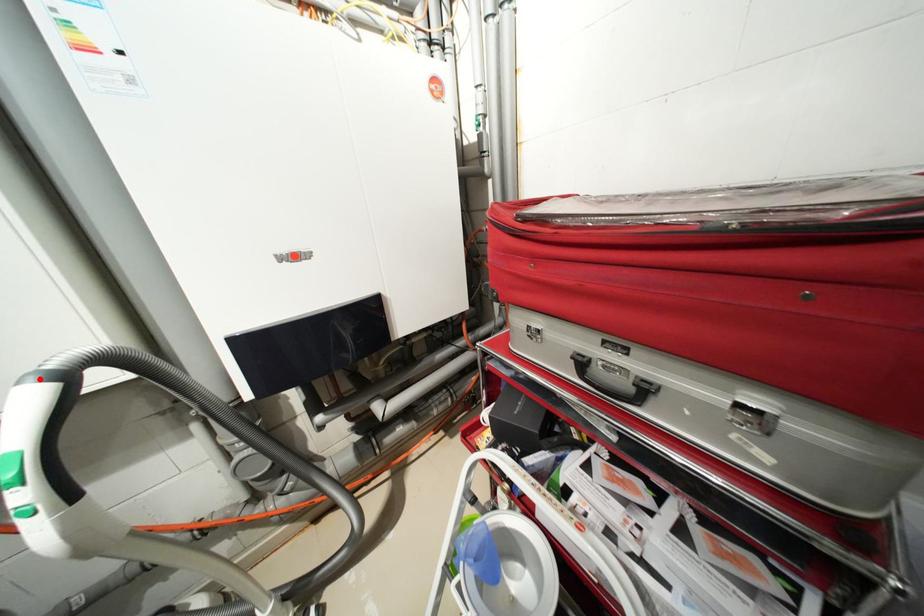
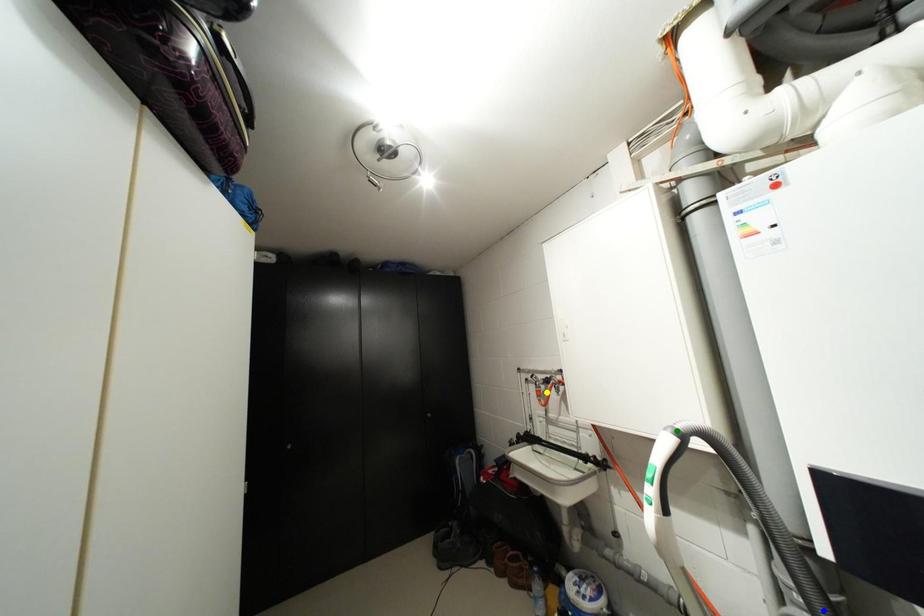
Question: I am providing you with two images of the same scene from different viewpoints. A red point is marked on the first image. You are given multiple points on the second image. Which point in image 2 is actually the same real-world point as the red point in image 1?

Choices:
 (A) blue point
 (B) green point
 (C) yellow point

Answer: (B)